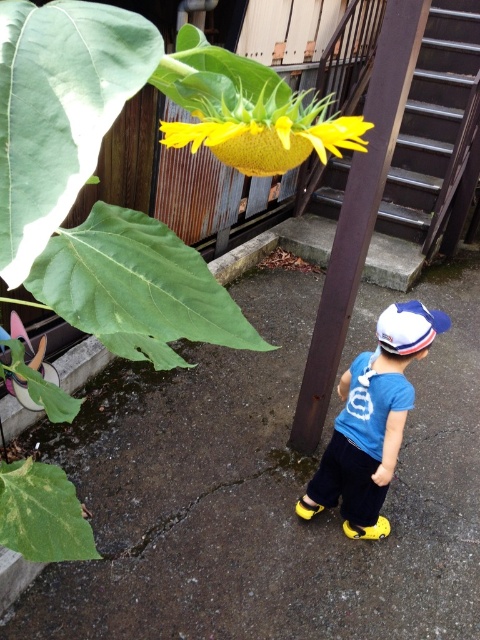
Question: Does blue cotton shirt at lower right have a greater width compared to white fabric baseball cap at lower center?

Choices:
 (A) yes
 (B) no

Answer: (A)

Question: Which point appears farthest from the camera in this image?

Choices:
 (A) (395, 12)
 (B) (386, 330)
 (C) (380, 323)

Answer: (C)

Question: Considering the real-world distances, which object is closest to the blue cotton shirt at lower right?

Choices:
 (A) brown wood pole at center
 (B) white fabric baseball cap at lower center

Answer: (B)

Question: Does blue cotton shirt at lower right appear over white fabric baseball cap at lower center?

Choices:
 (A) yes
 (B) no

Answer: (B)

Question: Does brown wood pole at center appear on the left side of white fabric baseball cap at lower center?

Choices:
 (A) no
 (B) yes

Answer: (B)

Question: Which object appears farthest from the camera in this image?

Choices:
 (A) blue cotton shirt at lower right
 (B) white fabric baseball cap at lower center
 (C) brown wood pole at center

Answer: (B)